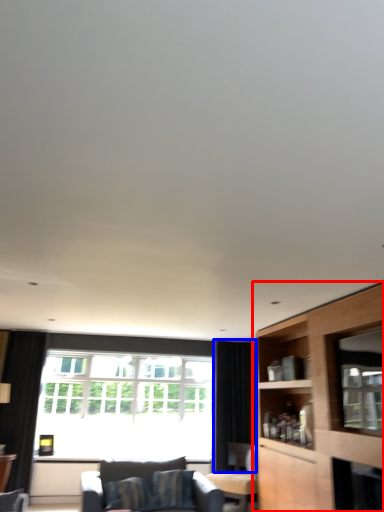
Question: Which point is closer to the camera, cabinetry (highlighted by a red box) or curtain (highlighted by a blue box)?

Choices:
 (A) cabinetry
 (B) curtain

Answer: (A)